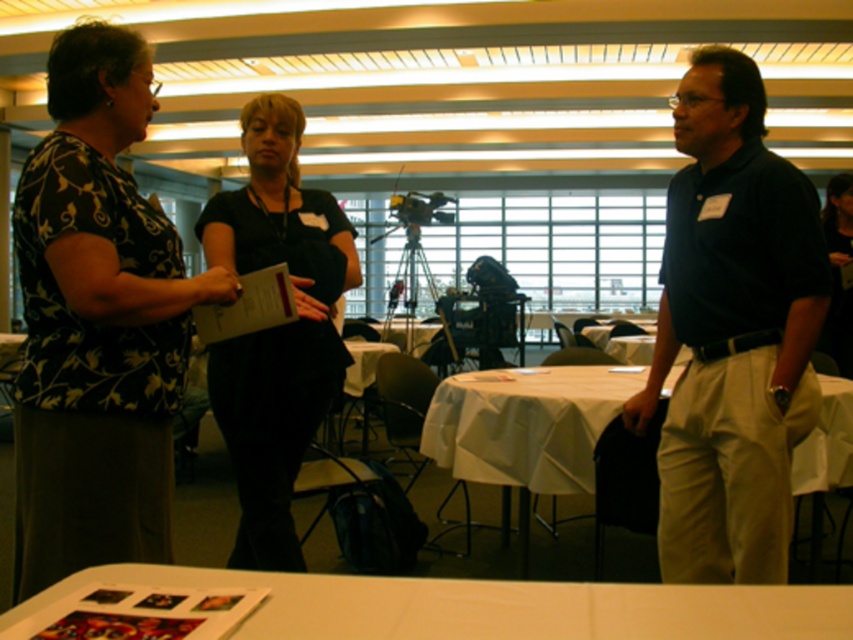
Is black floral blouse at left behind white cloth table at center?

No, black floral blouse at left is closer to the viewer.

You are a GUI agent. You are given a task and a screenshot of the screen. Output one action in this format:
    pyautogui.click(x=<x>, y=<y>)
    Task: Click on the black floral blouse at left
    This screenshot has width=853, height=640.
    Given the screenshot: What is the action you would take?
    pyautogui.click(x=97, y=323)

Between point (801, 179) and point (463, 413), which one is positioned in front?

Point (801, 179) is more forward.

Locate an element on the screen. dark blue shirt at center is located at coordinates (732, 332).

Consider the image. Does black matte shirt at center have a smaller size compared to white cloth table at center?

No, black matte shirt at center is not smaller than white cloth table at center.

Can you confirm if black matte shirt at center is positioned above white cloth table at center?

Yes, black matte shirt at center is above white cloth table at center.

Between point (341, 371) and point (628, 392), which one is positioned in front?

Point (341, 371)

The image size is (853, 640). What are the coordinates of `black matte shirt at center` in the screenshot? It's located at (276, 328).